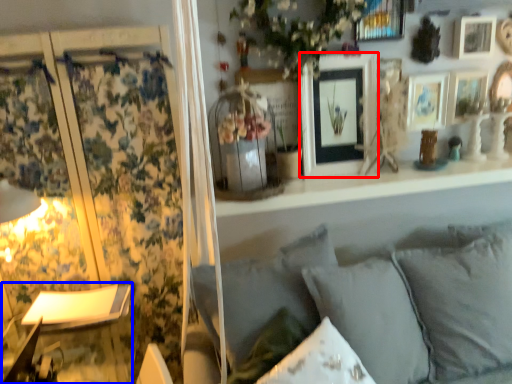
Question: Which point is closer to the camera, picture frame (highlighted by a red box) or table lamp (highlighted by a blue box)?

Choices:
 (A) picture frame
 (B) table lamp

Answer: (B)